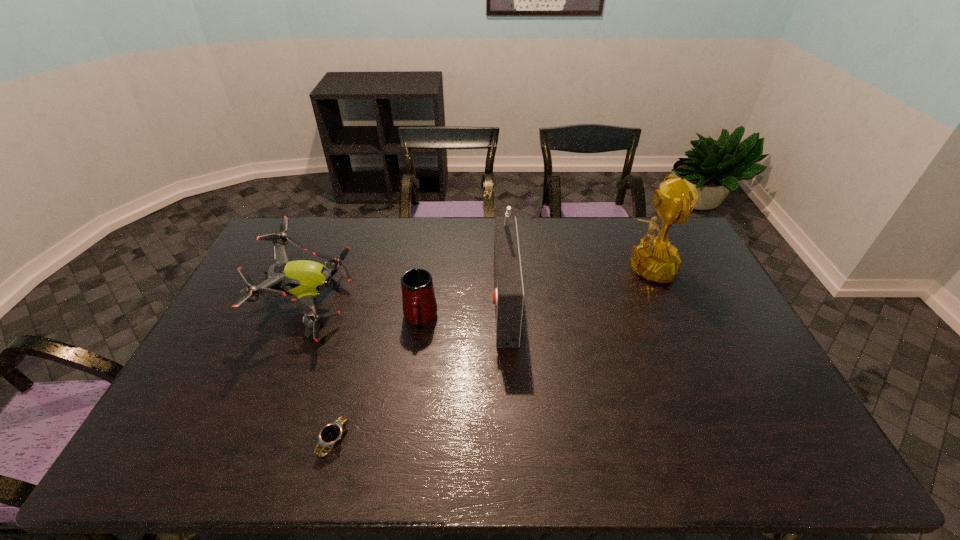
The image size is (960, 540). What are the coordinates of `object that is at the right edge` in the screenshot? It's located at (655, 259).

Find the location of a particular element. This screenshot has width=960, height=540. object positioned at the far right corner is located at coordinates (655, 259).

Image resolution: width=960 pixels, height=540 pixels. Find the location of `vacant space at the far edge of the desktop`. vacant space at the far edge of the desktop is located at coordinates (546, 238).

You are a GUI agent. You are given a task and a screenshot of the screen. Output one action in this format:
    pyautogui.click(x=<x>, y=<y>)
    Task: Click on the vacant space at the near edge of the desktop
    This screenshot has height=540, width=960.
    Given the screenshot: What is the action you would take?
    pyautogui.click(x=396, y=452)

At what (x,y) coordinates should I click in order to perform the action: click on free space at the left edge of the desktop. Please return your answer as a coordinate pair (x, y). Looking at the image, I should click on (263, 303).

This screenshot has height=540, width=960. What are the coordinates of `vacant space at the right edge of the desktop` in the screenshot? It's located at (764, 380).

In the image, there is a desktop. Identify the location of blank space at the far left corner. This screenshot has height=540, width=960. (296, 246).

The width and height of the screenshot is (960, 540). In order to click on vacant area between the rightmost object and the drone in this screenshot , I will do `click(477, 286)`.

Locate an element on the screen. The height and width of the screenshot is (540, 960). free space between the fourth object from left to right and the third object from left to right is located at coordinates (462, 309).

The width and height of the screenshot is (960, 540). In order to click on vacant space in between the leftmost object and the watch in this screenshot , I will do `click(322, 373)`.